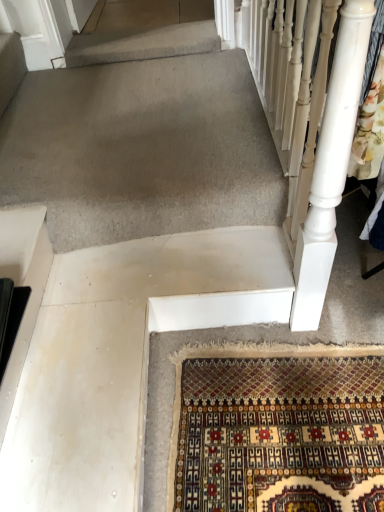
Question: Is white painted wood at right far from black plastic at left?

Choices:
 (A) no
 (B) yes

Answer: (A)

Question: From a real-world perspective, is white painted wood at right over black plastic at left?

Choices:
 (A) no
 (B) yes

Answer: (B)

Question: Could black plastic at left be considered to be inside white painted wood at right?

Choices:
 (A) no
 (B) yes

Answer: (A)

Question: From the image's perspective, is white painted wood at right below black plastic at left?

Choices:
 (A) yes
 (B) no

Answer: (B)

Question: Is white painted wood at right bigger than black plastic at left?

Choices:
 (A) yes
 (B) no

Answer: (A)

Question: Is white painted wood at right touching black plastic at left?

Choices:
 (A) no
 (B) yes

Answer: (A)

Question: Is black plastic at left not within white painted wood at right?

Choices:
 (A) yes
 (B) no

Answer: (A)

Question: Could white painted wood at right be considered to be inside black plastic at left?

Choices:
 (A) yes
 (B) no

Answer: (B)

Question: Does black plastic at left have a larger size compared to white painted wood at right?

Choices:
 (A) yes
 (B) no

Answer: (B)

Question: Are black plastic at left and white painted wood at right far apart?

Choices:
 (A) no
 (B) yes

Answer: (A)

Question: Is black plastic at left to the right of white painted wood at right from the viewer's perspective?

Choices:
 (A) yes
 (B) no

Answer: (B)

Question: From the image's perspective, would you say black plastic at left is shown under white painted wood at right?

Choices:
 (A) no
 (B) yes

Answer: (B)

Question: Is black plastic at left in front of or behind white painted wood at right in the image?

Choices:
 (A) front
 (B) behind

Answer: (B)